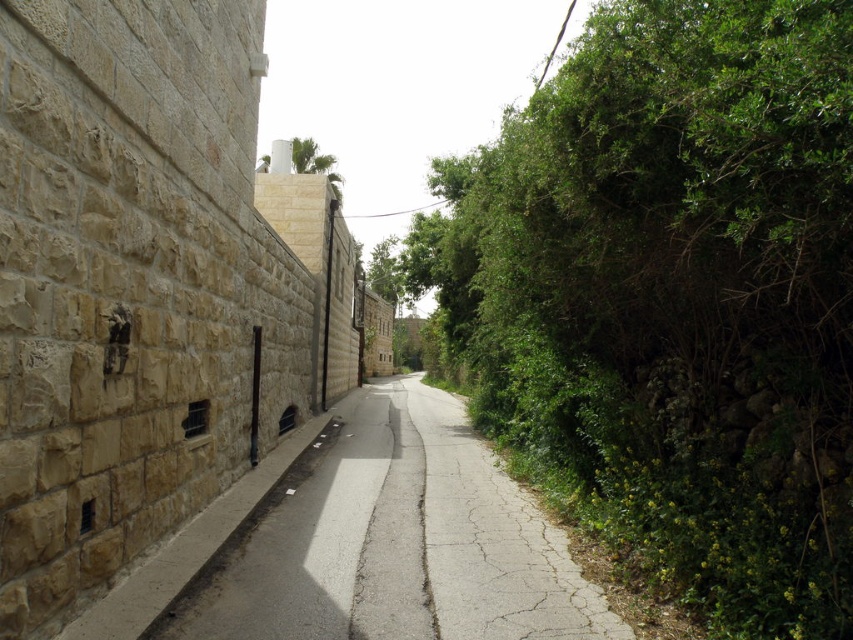
Question: Can you confirm if smooth concrete pavement at center is wider than green leafy tree at upper center?

Choices:
 (A) yes
 (B) no

Answer: (B)

Question: Which point is farther to the camera?

Choices:
 (A) (651, 492)
 (B) (260, 156)

Answer: (B)

Question: Is green leafy bush at right above smooth concrete pavement at center?

Choices:
 (A) yes
 (B) no

Answer: (A)

Question: Which point is farther from the camera taking this photo?

Choices:
 (A) (312, 461)
 (B) (299, 156)
 (C) (833, 308)

Answer: (B)

Question: Is green leafy bush at right positioned at the back of green leafy tree at upper center?

Choices:
 (A) no
 (B) yes

Answer: (A)

Question: Which point is farther to the camera?

Choices:
 (A) smooth concrete pavement at center
 (B) green leafy tree at upper center

Answer: (B)